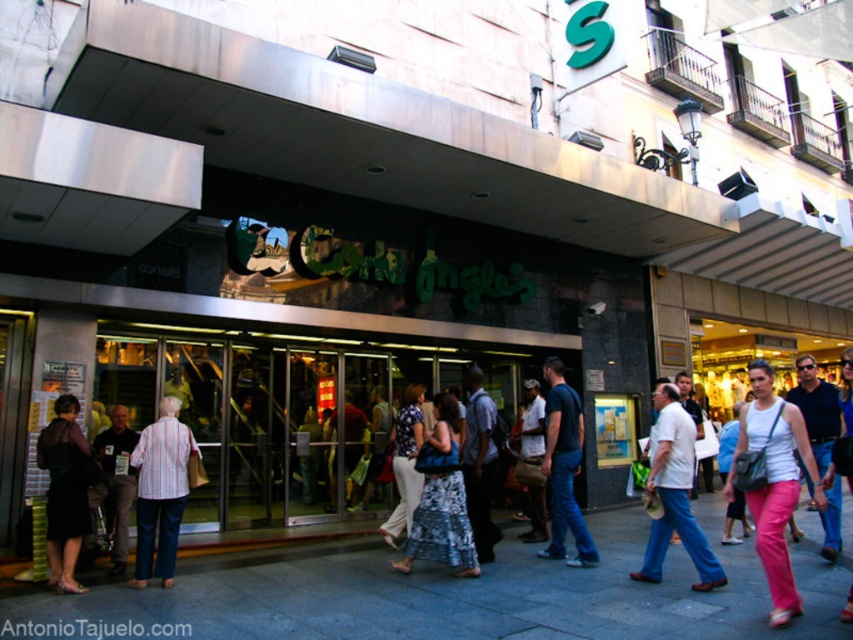
You are a delivery person trying to place a printed fabric dress at center on the gray concrete pavement at center. Will the dress fit entirely on the pavement?

The gray concrete pavement at center has a smaller size compared to printed fabric dress at center, so the dress will not fit entirely on the pavement.

You are standing in front of the Carrefour Anglo store and looking at the gray concrete pavement at center and the pink cotton pants at lower right. Which object is located lower in the image?

The gray concrete pavement at center is located below the pink cotton pants at lower right, so the gray concrete pavement at center is lower in the image.